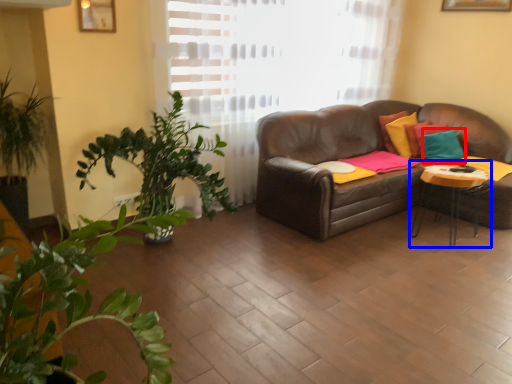
Question: Which of the following is the closest to the observer, pillow (highlighted by a red box) or table (highlighted by a blue box)?

Choices:
 (A) pillow
 (B) table

Answer: (B)